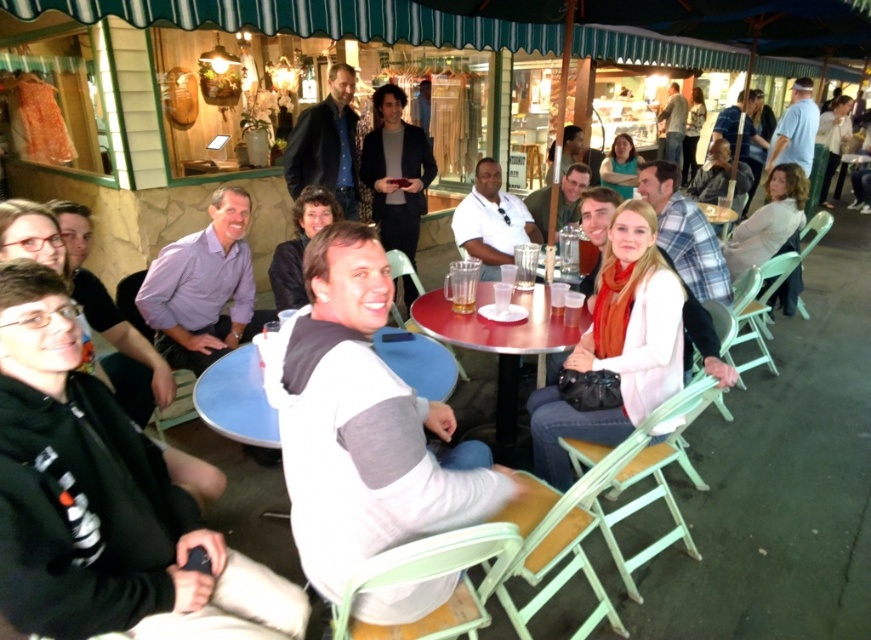
Consider the image. You are a customer at the outdoor cafe and want to find the white matte jacket at center and the purple shirt at center. Which one is taller?

The white matte jacket at center is taller than the purple shirt at center.

You are a customer at the outdoor cafe and want to reach the white matte jacket at center located at point (618, 344). The path is blocked by a table with a 1.2 meter width. Can you walk around it on the right side?

The white matte jacket at center is located at point (618, 344). Since the path is blocked by a table with a 1.2 meter width, you can walk around it on the right side as there is enough space to maneuver around the obstruction.

You are a customer at the outdoor cafe and want to grab the black leather jacket at center. However, you are currently standing behind the blue plastic table at center. Can you reach the jacket without moving around the table?

The blue plastic table at center is closer to the viewer than black leather jacket at center, so the table is between you and the jacket. You will need to move around the table to reach the black leather jacket at center.